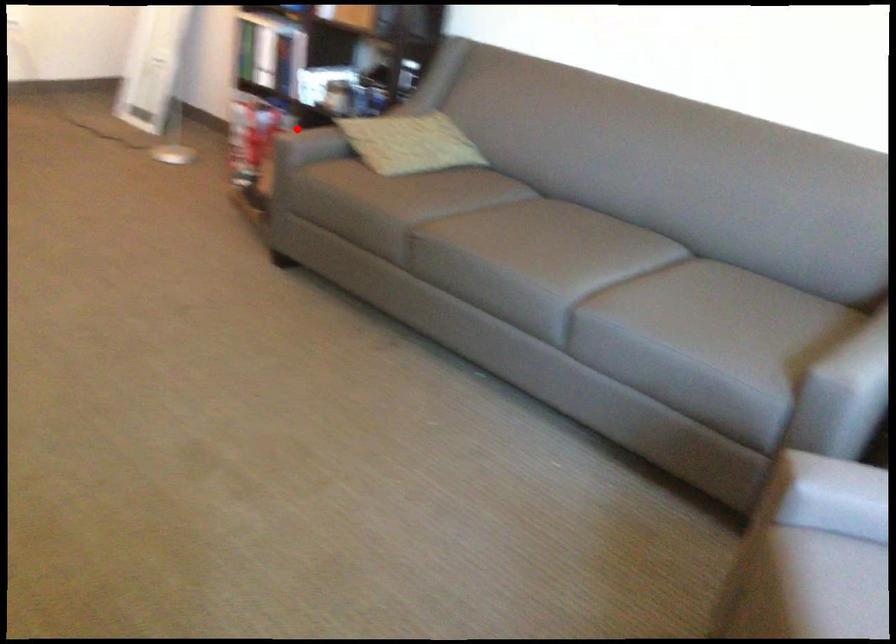
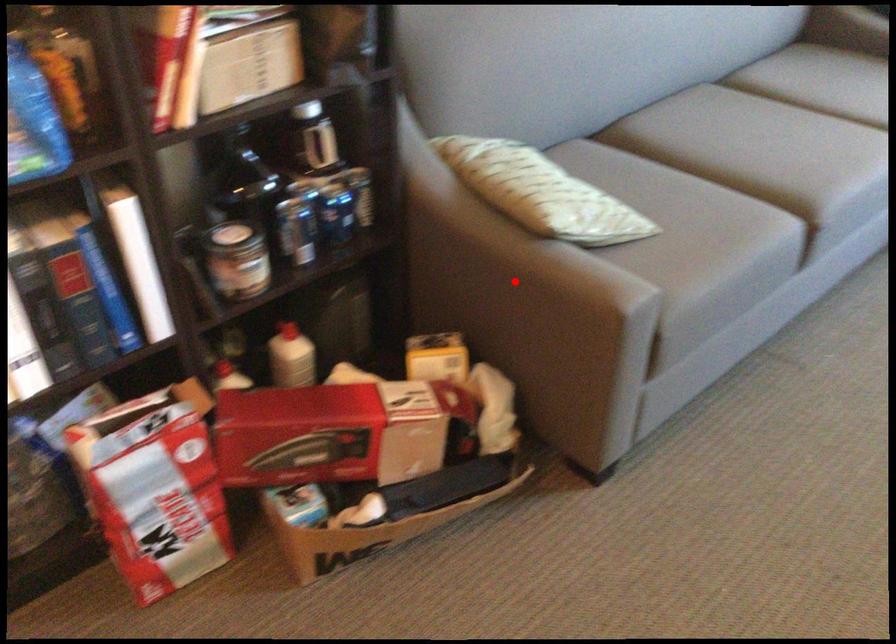
I am providing you with two images of the same scene from different viewpoints. A red point is marked on the first image and another point is marked on the second image. Is the red point in image1 aligned with the point shown in image2?

Yes